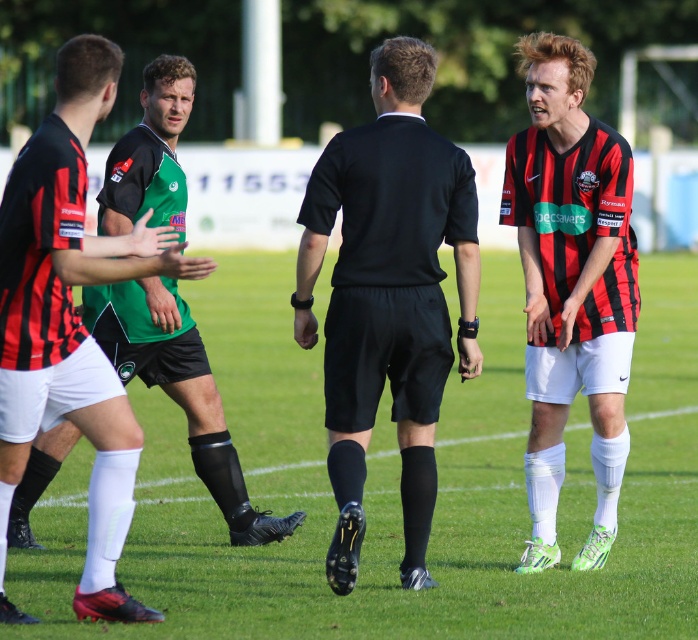
Who is shorter, matte black shorts at right or black matte shorts at center?

With less height is black matte shorts at center.

Which is behind, point (554, 141) or point (147, 195)?

The point (147, 195) is more distant.

You are a GUI agent. You are given a task and a screenshot of the screen. Output one action in this format:
    pyautogui.click(x=<x>, y=<y>)
    Task: Click on the matte black shorts at right
    The height and width of the screenshot is (640, 698).
    Given the screenshot: What is the action you would take?
    pyautogui.click(x=571, y=285)

You are a GUI agent. You are given a task and a screenshot of the screen. Output one action in this format:
    pyautogui.click(x=<x>, y=<y>)
    Task: Click on the black matte referee at center
    This screenshot has height=640, width=698.
    Given the screenshot: What is the action you would take?
    pyautogui.click(x=387, y=296)

Which of these two, black matte referee at center or black matte shorts at center, stands shorter?

With less height is black matte shorts at center.

Can you confirm if black matte referee at center is positioned above black matte shorts at center?

Yes.

The image size is (698, 640). Describe the element at coordinates (387, 296) in the screenshot. I see `black matte referee at center` at that location.

At what (x,y) coordinates should I click in order to perform the action: click on black matte referee at center. Please return your answer as a coordinate pair (x, y). The image size is (698, 640). Looking at the image, I should click on (387, 296).